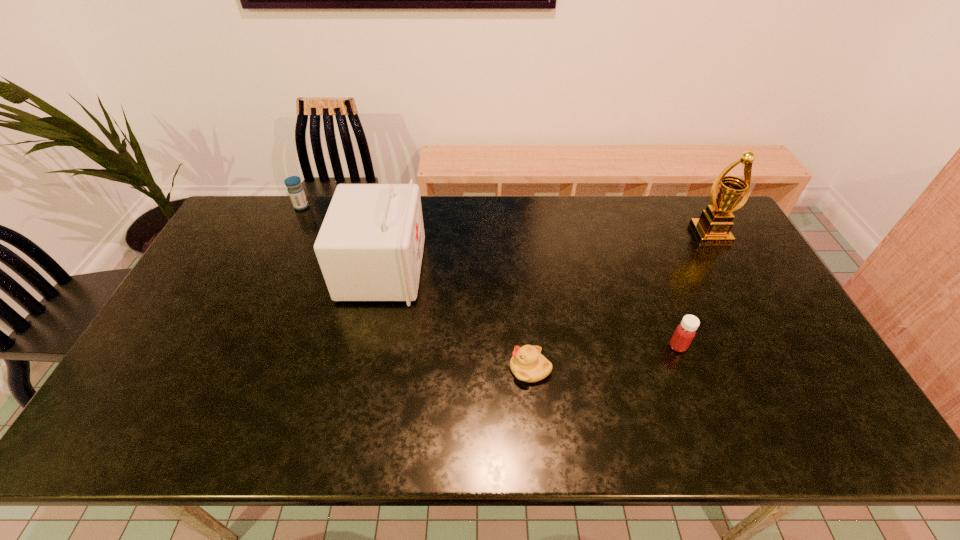
In the image, there is a desktop. Where is `free space at the far edge`? free space at the far edge is located at coordinates (291, 215).

This screenshot has height=540, width=960. Identify the location of free space at the near edge. (595, 419).

The height and width of the screenshot is (540, 960). In order to click on vacant space at the right edge in this screenshot , I will do `click(701, 247)`.

Find the location of a particular element. This screenshot has height=540, width=960. vacant space at the near right corner of the desktop is located at coordinates (834, 423).

Where is `free point between the farther medicine and the second object from right to left`? This screenshot has width=960, height=540. free point between the farther medicine and the second object from right to left is located at coordinates (490, 276).

Where is `unoccupied position between the rightmost object and the farther medicine`? This screenshot has height=540, width=960. unoccupied position between the rightmost object and the farther medicine is located at coordinates (506, 220).

Image resolution: width=960 pixels, height=540 pixels. In order to click on free area in between the award and the leftmost object in this screenshot , I will do `click(506, 220)`.

You are a GUI agent. You are given a task and a screenshot of the screen. Output one action in this format:
    pyautogui.click(x=<x>, y=<y>)
    Task: Click on the vacant area that lies between the nearer medicine and the leftmost object
    Image resolution: width=960 pixels, height=540 pixels.
    Given the screenshot: What is the action you would take?
    pyautogui.click(x=490, y=276)

Locate an element on the screen. The width and height of the screenshot is (960, 540). vacant area between the leftmost object and the fourth object from left to right is located at coordinates (490, 276).

Where is `free area in between the first-aid kit and the third object from right to left`? free area in between the first-aid kit and the third object from right to left is located at coordinates (456, 319).